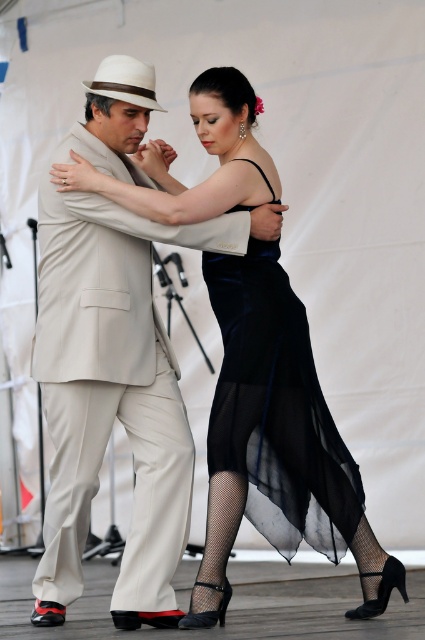
Between beige fabric suit at center and velvet black dress at center, which one is positioned lower?

Positioned lower is velvet black dress at center.

Can you confirm if beige fabric suit at center is positioned below velvet black dress at center?

No, beige fabric suit at center is not below velvet black dress at center.

Find the location of a particular element. The width and height of the screenshot is (425, 640). beige fabric suit at center is located at coordinates (112, 396).

The width and height of the screenshot is (425, 640). I want to click on beige fabric suit at center, so click(112, 396).